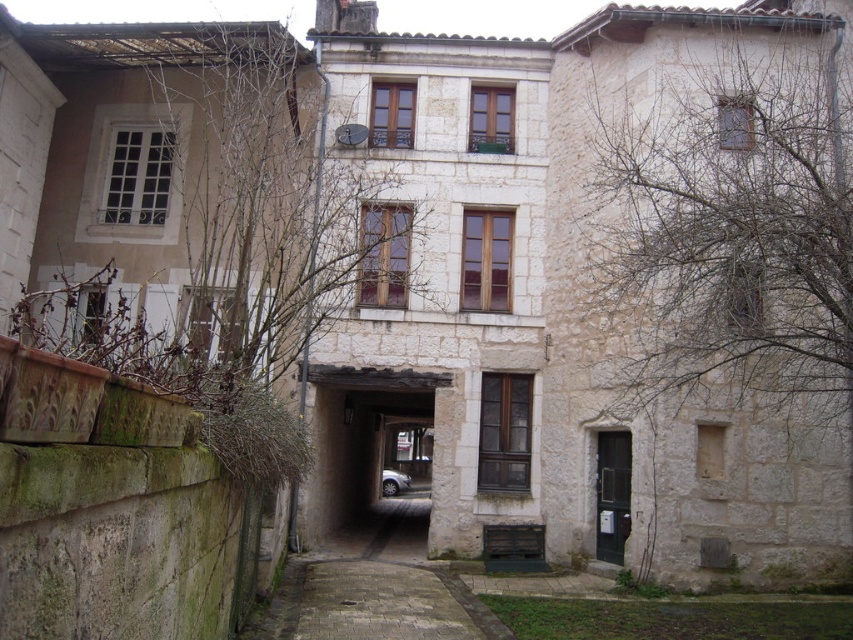
Question: Considering the relative positions of bare branches at left and silver metallic car at center in the image provided, where is bare branches at left located with respect to silver metallic car at center?

Choices:
 (A) left
 (B) right

Answer: (A)

Question: Which object appears farthest from the camera in this image?

Choices:
 (A) bare branches at right
 (B) silver metallic car at center
 (C) bare branches at left

Answer: (B)

Question: In this image, where is bare branches at right located relative to silver metallic car at center?

Choices:
 (A) left
 (B) right

Answer: (B)

Question: Among these points, which one is nearest to the camera?

Choices:
 (A) (200, 237)
 (B) (396, 484)

Answer: (A)

Question: Can you confirm if bare branches at left is positioned to the left of bare branches at right?

Choices:
 (A) no
 (B) yes

Answer: (B)

Question: Based on their relative distances, which object is farther from the bare branches at left?

Choices:
 (A) bare branches at right
 (B) silver metallic car at center

Answer: (B)